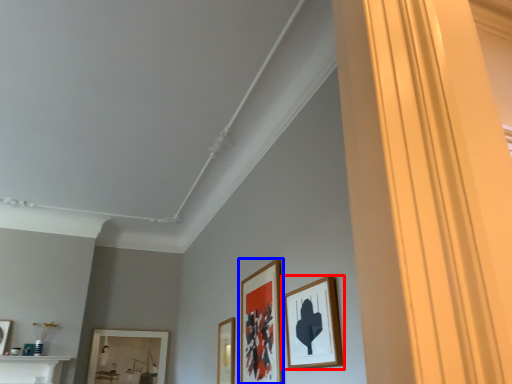
Question: Which point is further to the camera, picture frame (highlighted by a red box) or picture frame (highlighted by a blue box)?

Choices:
 (A) picture frame
 (B) picture frame

Answer: (B)